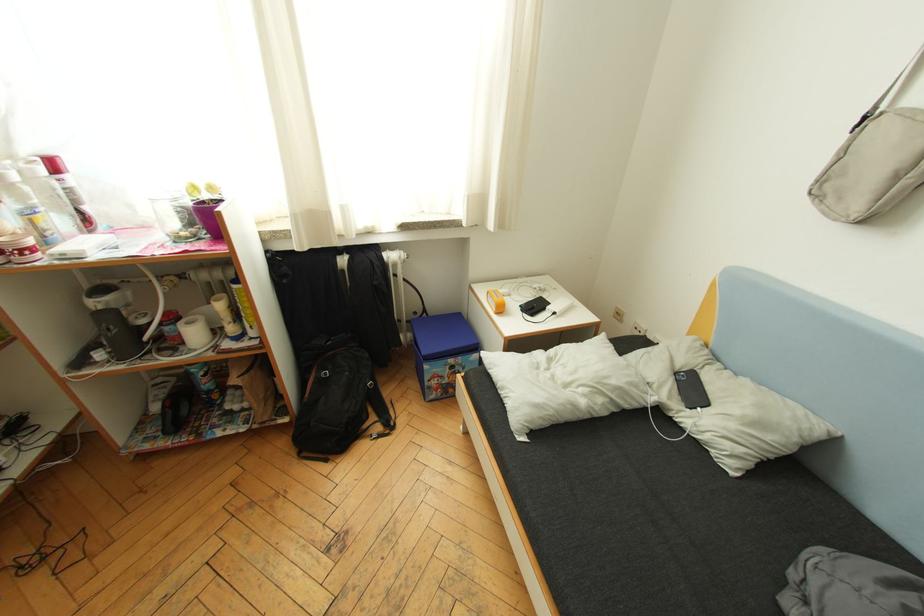
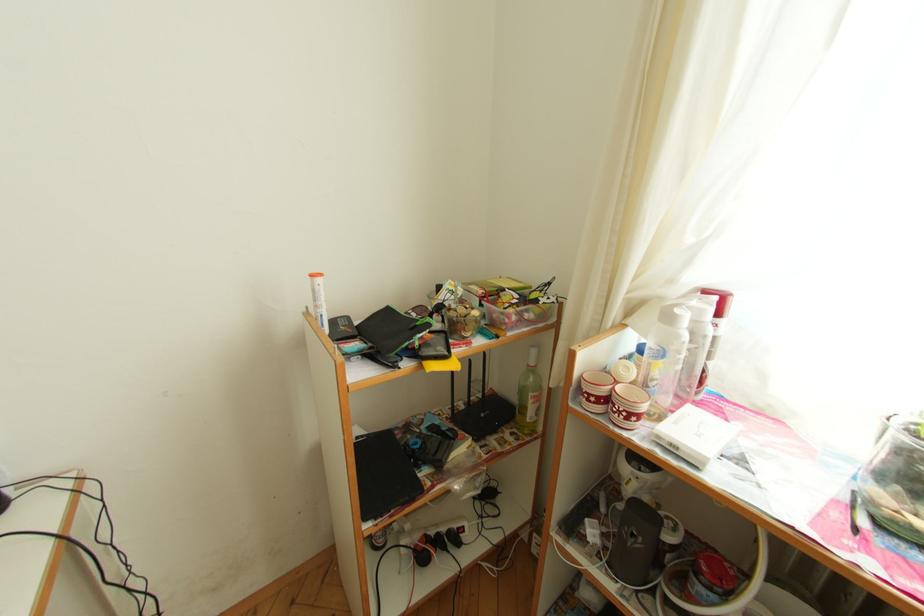
Question: The first image is from the beginning of the video and the second image is from the end. How did the camera likely rotate when shooting the video?

Choices:
 (A) Left
 (B) Right
 (C) Up
 (D) Down

Answer: (A)